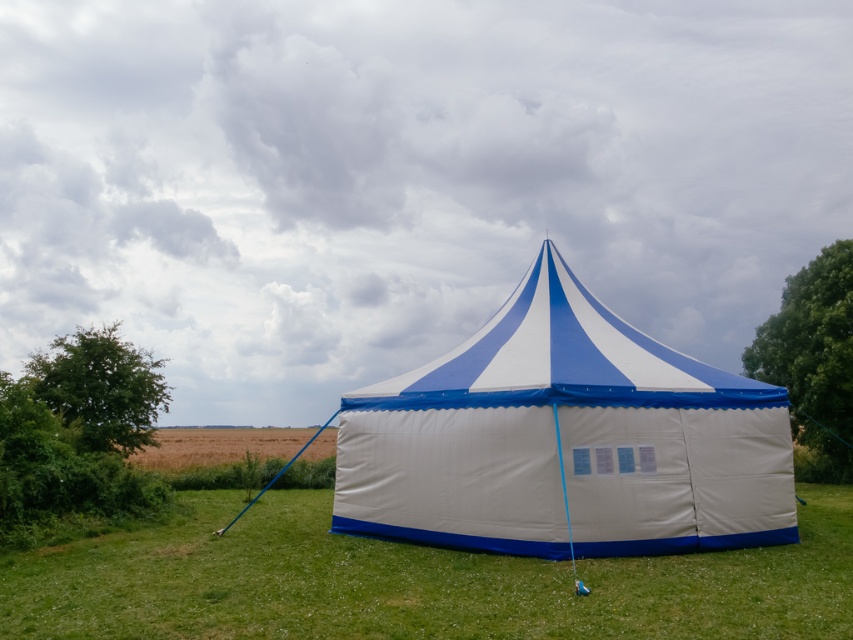
Question: Which object is closer to the camera taking this photo?

Choices:
 (A) green grass at lower center
 (B) blue/white striped tent at center

Answer: (A)

Question: Can you confirm if green grass at lower center is thinner than green leafy tree at right?

Choices:
 (A) yes
 (B) no

Answer: (B)

Question: Is green grass at lower center positioned at the back of green leafy tree at right?

Choices:
 (A) no
 (B) yes

Answer: (A)

Question: Which object appears closest to the camera in this image?

Choices:
 (A) blue/white striped tent at center
 (B) green leafy tree at right
 (C) green grass at lower center
 (D) green leafy tree at left

Answer: (C)

Question: Which of the following is the closest to the observer?

Choices:
 (A) (68, 348)
 (B) (676, 618)
 (C) (550, 515)
 (D) (848, 259)

Answer: (B)

Question: Is green grass at lower center to the right of green leafy tree at left from the viewer's perspective?

Choices:
 (A) no
 (B) yes

Answer: (B)